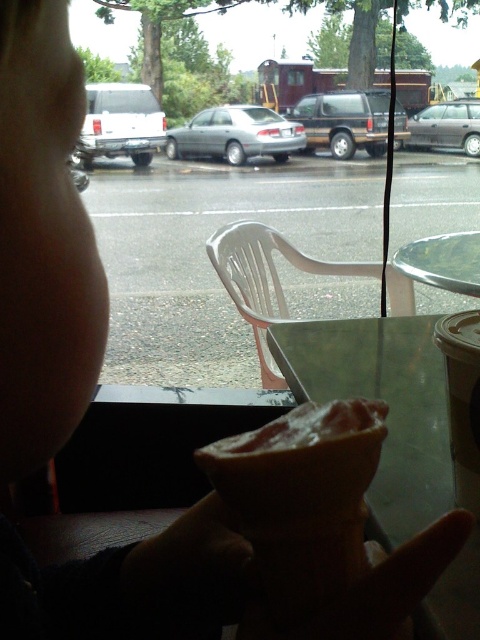
Question: Based on their relative distances, which object is nearer to the smooth beige hand at lower center?

Choices:
 (A) transparent glass table at center
 (B) satin silver sedan at center

Answer: (A)

Question: Is white plastic chair at center closer to camera compared to white matte van at left?

Choices:
 (A) yes
 (B) no

Answer: (A)

Question: Which of these objects is positioned closest to the transparent glass table at center?

Choices:
 (A) spongy pink cake at lower center
 (B) satin silver car at center

Answer: (A)

Question: Can you confirm if spongy pink cake at lower center is bigger than satin silver car at center?

Choices:
 (A) no
 (B) yes

Answer: (A)

Question: Is spongy pink cake at lower center thinner than brown matte suv at center?

Choices:
 (A) no
 (B) yes

Answer: (B)

Question: Which of the following is the farthest from the observer?

Choices:
 (A) spongy pink cake at lower center
 (B) white plastic chair at center
 (C) satin silver sedan at center
 (D) clear glass table at center

Answer: (C)